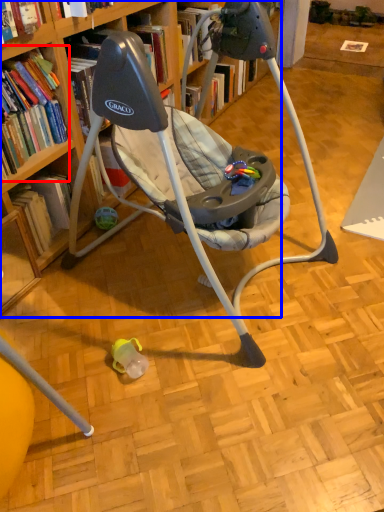
Question: Which object appears closest to the camera in this image, book (highlighted by a red box) or bookcase (highlighted by a blue box)?

Choices:
 (A) book
 (B) bookcase

Answer: (B)